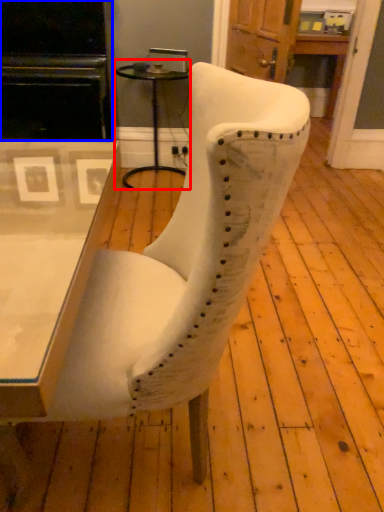
Question: Which object appears farthest to the camera in this image, side table (highlighted by a red box) or entertainment center (highlighted by a blue box)?

Choices:
 (A) side table
 (B) entertainment center

Answer: (A)